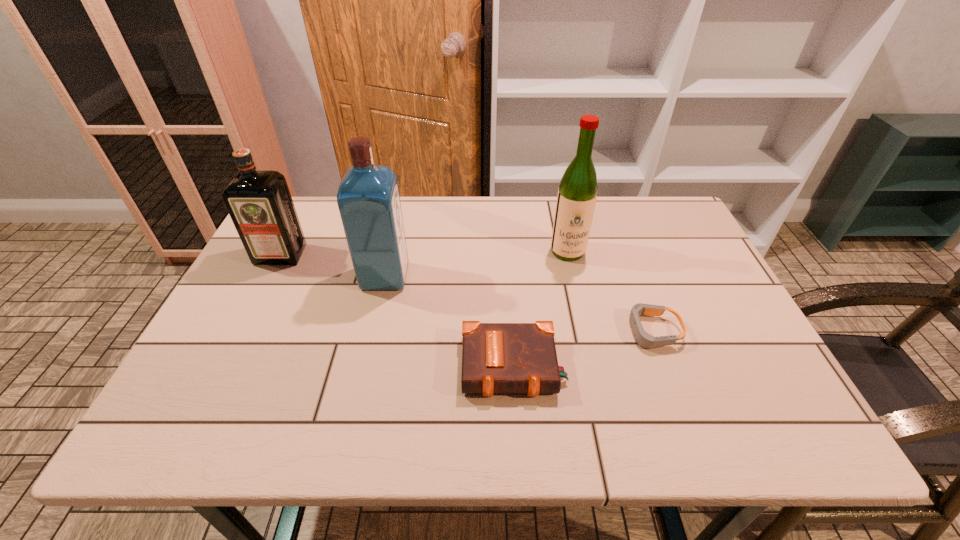
Locate an element on the screen. This screenshot has height=540, width=960. vacant area located on the front label of the shortest liquor is located at coordinates (239, 335).

Locate an element on the screen. This screenshot has width=960, height=540. free space located on the front and back of the rightmost object is located at coordinates (549, 332).

Find the location of a particular element. The width and height of the screenshot is (960, 540). vacant region located on the front and back of the rightmost object is located at coordinates (528, 332).

Identify the location of blank space located 0.140m on the front and back of the rightmost object. (565, 332).

The image size is (960, 540). Identify the location of object that is at the far edge. (577, 193).

The image size is (960, 540). I want to click on object at the left edge, so click(259, 202).

Identify the location of object present at the right edge. The image size is (960, 540). (644, 339).

Identify the location of vacant region at the far edge of the desktop. (606, 218).

In the image, there is a desktop. Where is `free space at the left edge`? free space at the left edge is located at coordinates (240, 393).

Locate an element on the screen. The height and width of the screenshot is (540, 960). vacant space at the right edge is located at coordinates (763, 364).